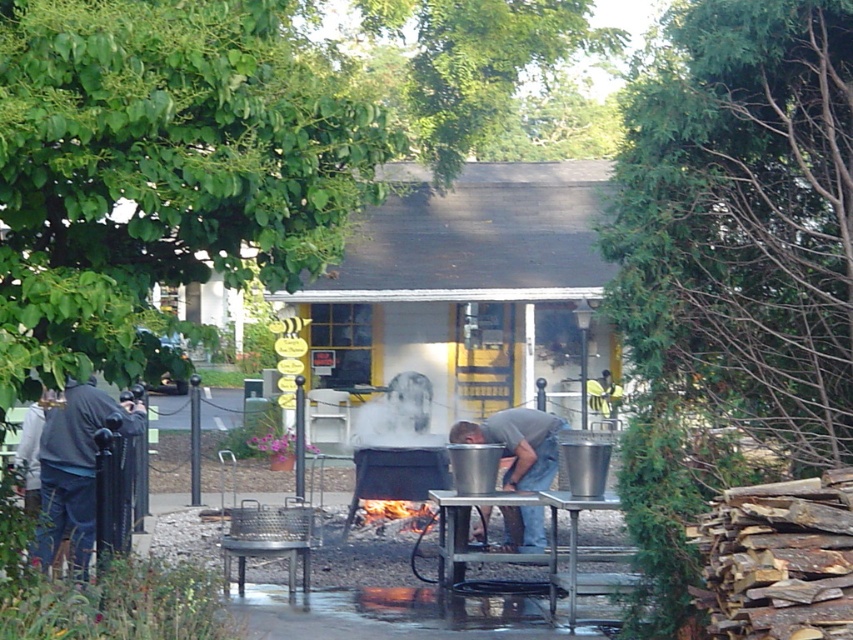
Question: Among these points, which one is nearest to the camera?

Choices:
 (A) (73, 500)
 (B) (418, 381)

Answer: (A)

Question: Is white foggy steam at center further to camera compared to charcoal gray wood at center?

Choices:
 (A) yes
 (B) no

Answer: (A)

Question: Based on their relative distances, which object is nearer to the charcoal gray wood at center?

Choices:
 (A) gray matte shirt at center
 (B) white foggy steam at center
 (C) dark gray fabric at left

Answer: (A)

Question: Can you confirm if dark gray fabric at left is wider than charcoal gray wood at center?

Choices:
 (A) yes
 (B) no

Answer: (A)

Question: Which point appears farthest from the camera in this image?

Choices:
 (A) (544, 481)
 (B) (381, 522)
 (C) (136, 420)

Answer: (B)

Question: Does white foggy steam at center have a greater width compared to charcoal gray wood at center?

Choices:
 (A) yes
 (B) no

Answer: (A)